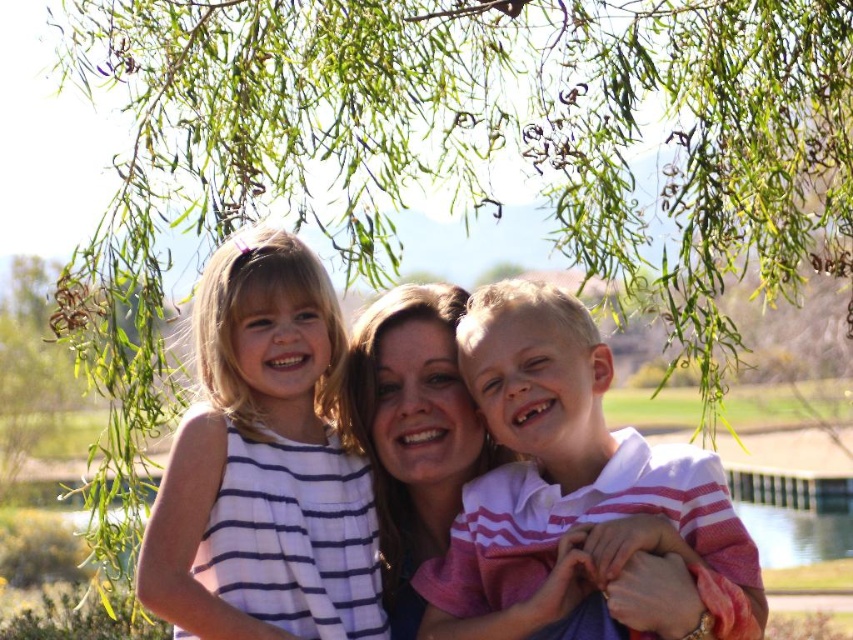
You are a photographer trying to capture the white striped dress at center in your shot. According to the coordinates provided, where should you position your camera to ensure the dress is centered in the frame?

The white striped dress at center is located at point (263, 465). To center it in the frame, position your camera so that the dress aligns with the center coordinates of your viewfinder.

You are a photographer standing 2 meters away from the white striped dress at center and the white striped shirt at center. You want to take a photo that includes both subjects in the frame. Given that your camera has a maximum focus range of 1.5 meters, will you be able to capture both subjects clearly?

The distance between the white striped dress at center and the white striped shirt at center is 1.40 meters. Since you are 2 meters away from both subjects, the total distance from the camera to each subject is within the 1.5 meter focus range. Therefore, both subjects will be in focus and clearly captured in the photo.

You are standing at the point labeled as point (729, 541) and want to walk to the point labeled as point (345, 556). Based on the scene description, will you be moving forward or backward?

Since point (345, 556) is behind point (729, 541), moving to it from your current position would mean you are moving backward.